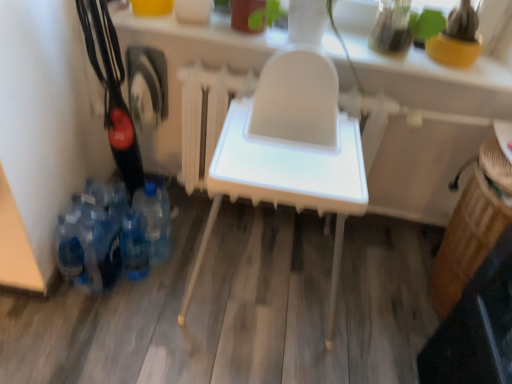
This screenshot has width=512, height=384. Describe the element at coordinates (93, 236) in the screenshot. I see `blue plastic bottles at lower left, the third bottle in the right-to-left sequence` at that location.

What is the approximate width of blue translucent bottle at lower left, the second bottle when ordered from right to left?

blue translucent bottle at lower left, the second bottle when ordered from right to left, is 3.90 inches in width.

The width and height of the screenshot is (512, 384). What do you see at coordinates (286, 182) in the screenshot?
I see `white plastic high chair at center` at bounding box center [286, 182].

This screenshot has height=384, width=512. In order to click on white plastic highchair at center in this screenshot , I will do `click(426, 126)`.

Identify the location of blue plastic bottles at lower left, the third bottle in the right-to-left sequence. (93, 236).

Looking at this image, in terms of size, does blue plastic bottle at lower left, marked as the 3th bottle in a left-to-right arrangement, appear bigger or smaller than blue translucent bottle at lower left, the second bottle in the left-to-right sequence?

Considering their sizes, blue plastic bottle at lower left, marked as the 3th bottle in a left-to-right arrangement, takes up more space than blue translucent bottle at lower left, the second bottle in the left-to-right sequence.

How much distance is there between blue plastic bottle at lower left, arranged as the first bottle when viewed from the right, and blue translucent bottle at lower left, the second bottle when ordered from right to left?

blue plastic bottle at lower left, arranged as the first bottle when viewed from the right, is 4.14 inches away from blue translucent bottle at lower left, the second bottle when ordered from right to left.

Does point (159, 236) lie in front of point (141, 234)?

No, (159, 236) is behind (141, 234).

Is blue plastic bottle at lower left, marked as the 3th bottle in a left-to-right arrangement, directly adjacent to blue translucent bottle at lower left, the second bottle when ordered from right to left?

blue plastic bottle at lower left, marked as the 3th bottle in a left-to-right arrangement, and blue translucent bottle at lower left, the second bottle when ordered from right to left, are clearly separated.

Between white plastic high chair at center and blue translucent bottle at lower left, the second bottle in the left-to-right sequence, which one has larger width?

Wider between the two is white plastic high chair at center.

From the image's perspective, is white plastic high chair at center located above or below blue translucent bottle at lower left, the second bottle in the left-to-right sequence?

Based on their image positions, white plastic high chair at center is located above blue translucent bottle at lower left, the second bottle in the left-to-right sequence.

Find the location of `furniture located on the right of blue translucent bottle at lower left, the second bottle when ordered from right to left`. furniture located on the right of blue translucent bottle at lower left, the second bottle when ordered from right to left is located at coordinates click(x=286, y=182).

Would you say white plastic high chair at center is a long distance from blue translucent bottle at lower left, the second bottle when ordered from right to left?

white plastic high chair at center is actually quite close to blue translucent bottle at lower left, the second bottle when ordered from right to left.

Is blue plastic bottle at lower left, marked as the 3th bottle in a left-to-right arrangement, wider or thinner than white plastic high chair at center?

blue plastic bottle at lower left, marked as the 3th bottle in a left-to-right arrangement, is thinner than white plastic high chair at center.

From the picture: Can you see blue plastic bottle at lower left, arranged as the first bottle when viewed from the right, touching white plastic high chair at center?

No, blue plastic bottle at lower left, arranged as the first bottle when viewed from the right, is not next to white plastic high chair at center.

Consider the image. Is white plastic high chair at center at the back of blue plastic bottle at lower left, arranged as the first bottle when viewed from the right?

No, white plastic high chair at center is not at the back of blue plastic bottle at lower left, arranged as the first bottle when viewed from the right.

Does blue plastic bottle at lower left, arranged as the first bottle when viewed from the right, have a larger size compared to white plastic high chair at center?

Actually, blue plastic bottle at lower left, arranged as the first bottle when viewed from the right, might be smaller than white plastic high chair at center.

Is point (150, 235) closer or farther from the camera than point (94, 210)?

Point (150, 235) appears to be farther away from the viewer than point (94, 210).

From a real-world perspective, is blue plastic bottle at lower left, marked as the 3th bottle in a left-to-right arrangement, located higher than blue plastic bottles at lower left, which ranks as the first bottle in left-to-right order?

Indeed, from a real-world perspective, blue plastic bottle at lower left, marked as the 3th bottle in a left-to-right arrangement, stands above blue plastic bottles at lower left, which ranks as the first bottle in left-to-right order.

Is blue plastic bottle at lower left, marked as the 3th bottle in a left-to-right arrangement, thinner than blue plastic bottles at lower left, the third bottle in the right-to-left sequence?

Indeed, blue plastic bottle at lower left, marked as the 3th bottle in a left-to-right arrangement, has a lesser width compared to blue plastic bottles at lower left, the third bottle in the right-to-left sequence.

Who is smaller, blue plastic bottles at lower left, the third bottle in the right-to-left sequence, or white plastic high chair at center?

blue plastic bottles at lower left, the third bottle in the right-to-left sequence, is smaller.

Is point (84, 220) closer to camera compared to point (361, 200)?

That is False.

Which of these two, blue plastic bottles at lower left, which ranks as the first bottle in left-to-right order, or white plastic high chair at center, stands taller?

With more height is white plastic high chair at center.

How far apart are blue plastic bottles at lower left, the third bottle in the right-to-left sequence, and white plastic high chair at center?

47.74 centimeters.

Is the depth of white plastic high chair at center greater than that of blue plastic bottle at lower left, arranged as the first bottle when viewed from the right?

No, it is not.

Visually, is white plastic high chair at center positioned to the left or to the right of blue plastic bottle at lower left, arranged as the first bottle when viewed from the right?

white plastic high chair at center is to the right of blue plastic bottle at lower left, arranged as the first bottle when viewed from the right.

Looking at this image, does white plastic high chair at center have a greater width compared to blue plastic bottle at lower left, marked as the 3th bottle in a left-to-right arrangement?

Indeed, white plastic high chair at center has a greater width compared to blue plastic bottle at lower left, marked as the 3th bottle in a left-to-right arrangement.

Is blue translucent bottle at lower left, the second bottle when ordered from right to left, taller or shorter than blue plastic bottle at lower left, arranged as the first bottle when viewed from the right?

In the image, blue translucent bottle at lower left, the second bottle when ordered from right to left, appears to be shorter than blue plastic bottle at lower left, arranged as the first bottle when viewed from the right.

From a real-world perspective, is blue translucent bottle at lower left, the second bottle in the left-to-right sequence, physically above blue plastic bottle at lower left, arranged as the first bottle when viewed from the right?

No, from a real-world perspective, blue translucent bottle at lower left, the second bottle in the left-to-right sequence, is not over blue plastic bottle at lower left, arranged as the first bottle when viewed from the right

Would you say blue translucent bottle at lower left, the second bottle in the left-to-right sequence, is inside or outside blue plastic bottle at lower left, arranged as the first bottle when viewed from the right?

blue translucent bottle at lower left, the second bottle in the left-to-right sequence, is outside blue plastic bottle at lower left, arranged as the first bottle when viewed from the right.

Considering the positions of objects blue translucent bottle at lower left, the second bottle when ordered from right to left, and blue plastic bottle at lower left, arranged as the first bottle when viewed from the right, in the image provided, who is more to the right, blue translucent bottle at lower left, the second bottle when ordered from right to left, or blue plastic bottle at lower left, arranged as the first bottle when viewed from the right,?

Positioned to the right is blue plastic bottle at lower left, arranged as the first bottle when viewed from the right.

From the image's perspective, which bottle is the 2nd one below the blue plastic bottle at lower left, arranged as the first bottle when viewed from the right? Please provide its 2D coordinates.

[(133, 247)]

Where is `furniture above the blue translucent bottle at lower left, the second bottle in the left-to-right sequence (from the image's perspective)`? This screenshot has height=384, width=512. furniture above the blue translucent bottle at lower left, the second bottle in the left-to-right sequence (from the image's perspective) is located at coordinates (286, 182).

Considering their positions, is white plastic high chair at center positioned further to white plastic highchair at center than blue translucent bottle at lower left, the second bottle when ordered from right to left?

blue translucent bottle at lower left, the second bottle when ordered from right to left, is positioned further to the anchor white plastic highchair at center.

Which object lies further to the anchor point blue plastic bottle at lower left, arranged as the first bottle when viewed from the right, white plastic high chair at center or blue plastic bottles at lower left, which ranks as the first bottle in left-to-right order?

The object further to blue plastic bottle at lower left, arranged as the first bottle when viewed from the right, is white plastic high chair at center.

Looking at the image, which one is located further to white plastic high chair at center, blue translucent bottle at lower left, the second bottle in the left-to-right sequence, or white plastic highchair at center?

blue translucent bottle at lower left, the second bottle in the left-to-right sequence, is positioned further to the anchor white plastic high chair at center.

From the image, which object appears to be farther from blue plastic bottles at lower left, the third bottle in the right-to-left sequence, white plastic high chair at center or blue translucent bottle at lower left, the second bottle when ordered from right to left?

white plastic high chair at center.

Which object lies further to the anchor point white plastic high chair at center, blue plastic bottle at lower left, marked as the 3th bottle in a left-to-right arrangement, or blue plastic bottles at lower left, which ranks as the first bottle in left-to-right order?

Among the two, blue plastic bottle at lower left, marked as the 3th bottle in a left-to-right arrangement, is located further to white plastic high chair at center.

From the image, which object appears to be nearer to blue translucent bottle at lower left, the second bottle in the left-to-right sequence, blue plastic bottles at lower left, the third bottle in the right-to-left sequence, or blue plastic bottle at lower left, marked as the 3th bottle in a left-to-right arrangement?

blue plastic bottles at lower left, the third bottle in the right-to-left sequence.

Looking at the image, which one is located further to white plastic high chair at center, blue plastic bottles at lower left, which ranks as the first bottle in left-to-right order, or blue plastic bottle at lower left, marked as the 3th bottle in a left-to-right arrangement?

Among the two, blue plastic bottle at lower left, marked as the 3th bottle in a left-to-right arrangement, is located further to white plastic high chair at center.

Which object lies nearer to the anchor point blue plastic bottles at lower left, the third bottle in the right-to-left sequence, white plastic highchair at center or white plastic high chair at center?

Based on the image, white plastic high chair at center appears to be nearer to blue plastic bottles at lower left, the third bottle in the right-to-left sequence.

The image size is (512, 384). Identify the location of furniture between blue plastic bottles at lower left, which ranks as the first bottle in left-to-right order, and white plastic highchair at center from left to right. (286, 182).

Locate an element on the screen. This screenshot has width=512, height=384. furniture situated between blue plastic bottle at lower left, arranged as the first bottle when viewed from the right, and white plastic highchair at center from left to right is located at coordinates (286, 182).

Locate an element on the screen. Image resolution: width=512 pixels, height=384 pixels. bottle between blue plastic bottles at lower left, which ranks as the first bottle in left-to-right order, and blue plastic bottle at lower left, arranged as the first bottle when viewed from the right, from left to right is located at coordinates (133, 247).

The image size is (512, 384). I want to click on bottle between blue translucent bottle at lower left, the second bottle in the left-to-right sequence, and white plastic highchair at center, in the horizontal direction, so click(154, 218).